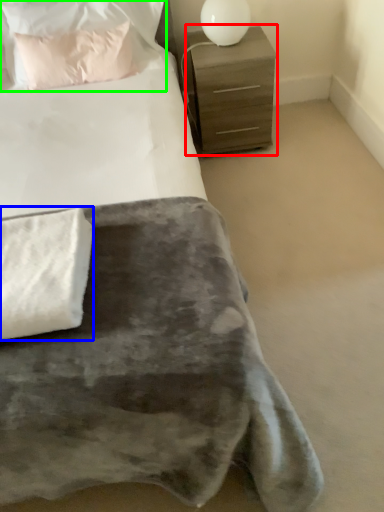
Question: Which is nearer to the chest of drawers (highlighted by a red box)? blanket (highlighted by a blue box) or pillow (highlighted by a green box).

Choices:
 (A) blanket
 (B) pillow

Answer: (B)